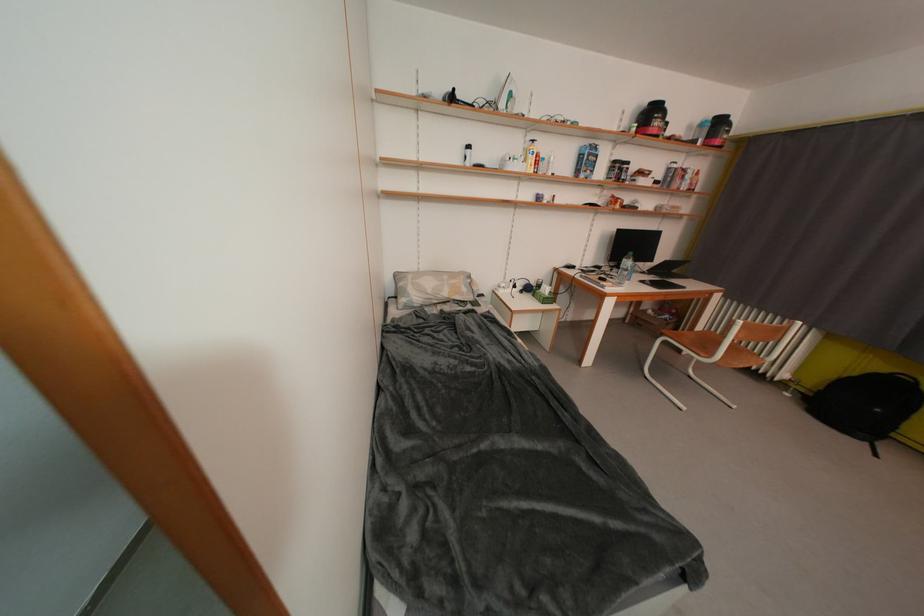
At what (x,y) coordinates should I click in order to perform the action: click on chair sitting surface. Please return your answer as a coordinate pair (x, y). The width and height of the screenshot is (924, 616). Looking at the image, I should click on (696, 339).